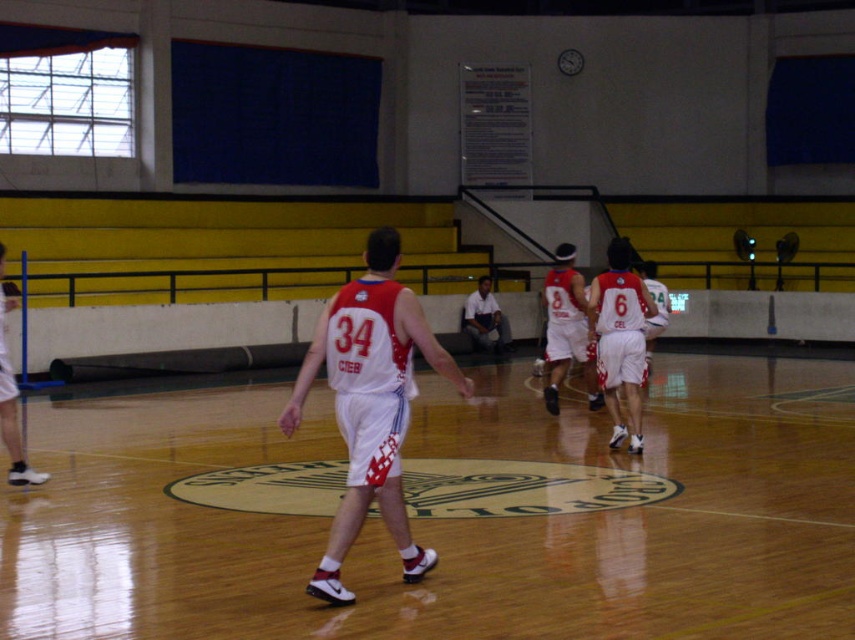
Between wooden floor at center and white matte basketball jersey at center, which one appears on the left side from the viewer's perspective?

wooden floor at center

Is wooden floor at center bigger than white matte basketball jersey at center?

Yes, wooden floor at center is bigger than white matte basketball jersey at center.

Where is `wooden floor at center`? The image size is (855, 640). wooden floor at center is located at coordinates (447, 515).

Where is `wooden floor at center`? This screenshot has height=640, width=855. wooden floor at center is located at coordinates (447, 515).

Based on the photo, can you confirm if wooden floor at center is thinner than white cotton shirt at center?

No.

Is wooden floor at center to the left of white cotton shirt at center from the viewer's perspective?

Yes, wooden floor at center is to the left of white cotton shirt at center.

I want to click on wooden floor at center, so click(447, 515).

Is white matte basketball uniform at center in front of white cotton shirt at center?

Yes, white matte basketball uniform at center is in front of white cotton shirt at center.

In order to click on white matte basketball uniform at center in this screenshot , I will do `click(369, 378)`.

The image size is (855, 640). Find the location of `white matte basketball uniform at center`. white matte basketball uniform at center is located at coordinates (369, 378).